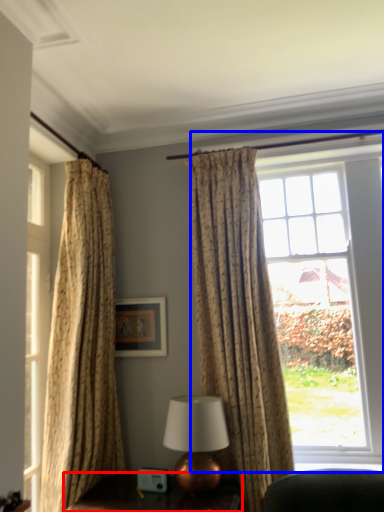
Question: Which of the following is the farthest to the observer, furniture (highlighted by a red box) or window (highlighted by a blue box)?

Choices:
 (A) furniture
 (B) window

Answer: (B)